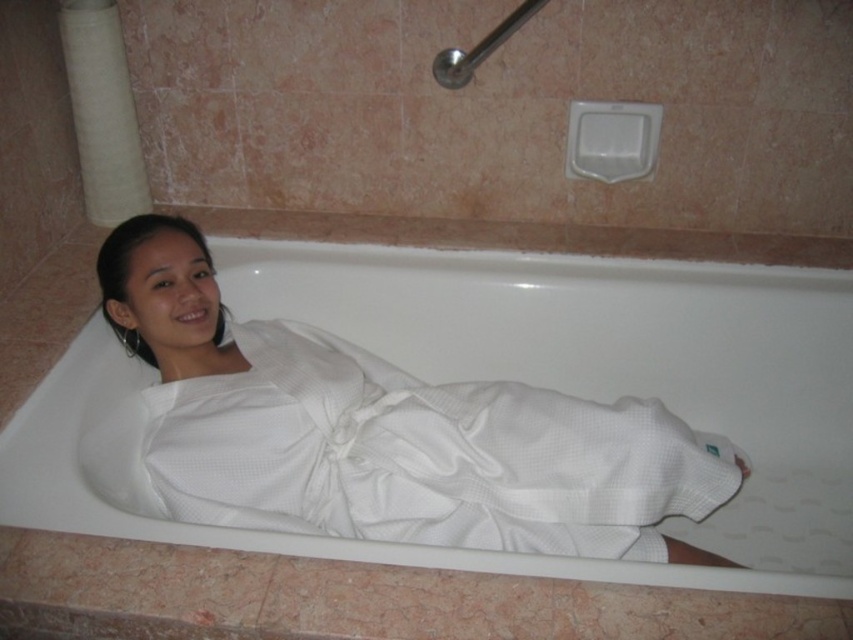
Which of these two, white waffle-textured robe at center or white textured bathrobe at center, stands shorter?

white textured bathrobe at center

Which is below, white waffle-textured robe at center or white textured bathrobe at center?

white textured bathrobe at center is lower down.

The width and height of the screenshot is (853, 640). What do you see at coordinates (511, 380) in the screenshot?
I see `white waffle-textured robe at center` at bounding box center [511, 380].

This screenshot has width=853, height=640. I want to click on white waffle-textured robe at center, so click(x=511, y=380).